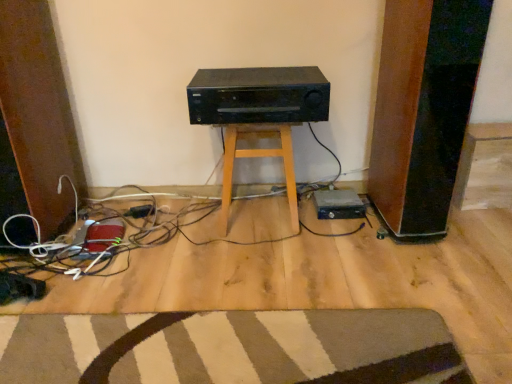
The width and height of the screenshot is (512, 384). Find the location of `vacant space situated on the left part of wooden stool at center`. vacant space situated on the left part of wooden stool at center is located at coordinates (186, 223).